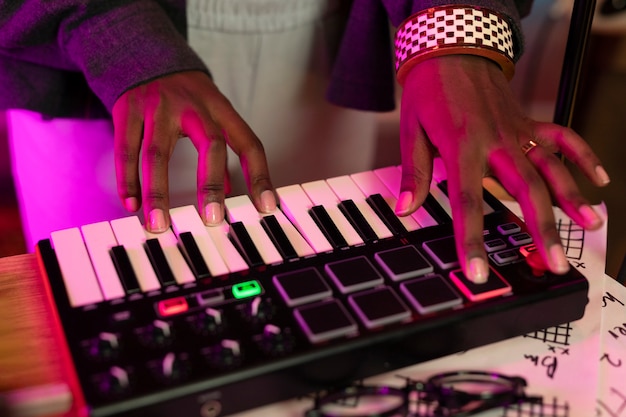
Find the location of a particular element. The height and width of the screenshot is (417, 626). black keyboard keys is located at coordinates (126, 272), (160, 268), (195, 257), (245, 243), (275, 242), (329, 225), (359, 220), (387, 214), (432, 205), (446, 186).